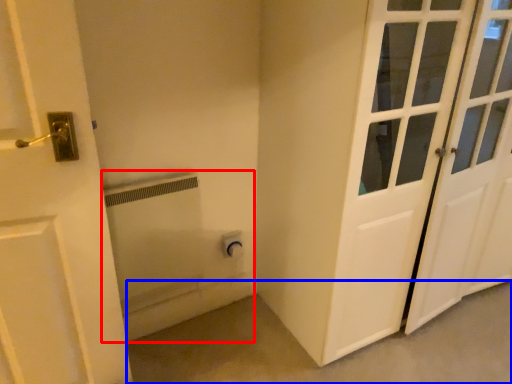
Question: Which point is further to the camera, bath (highlighted by a red box) or concrete (highlighted by a blue box)?

Choices:
 (A) bath
 (B) concrete

Answer: (A)